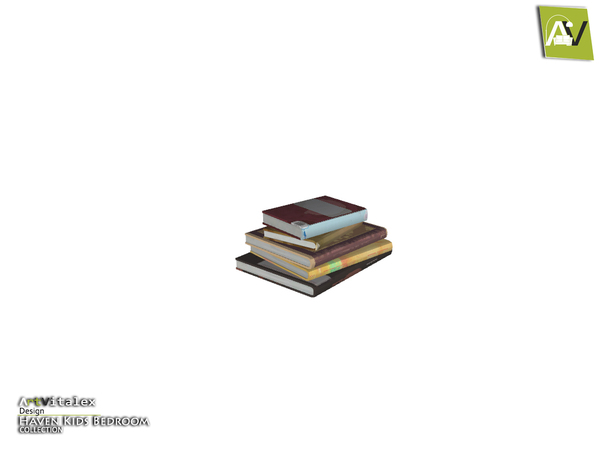
The height and width of the screenshot is (450, 600). I want to click on space to right of books, so pyautogui.click(x=496, y=245).